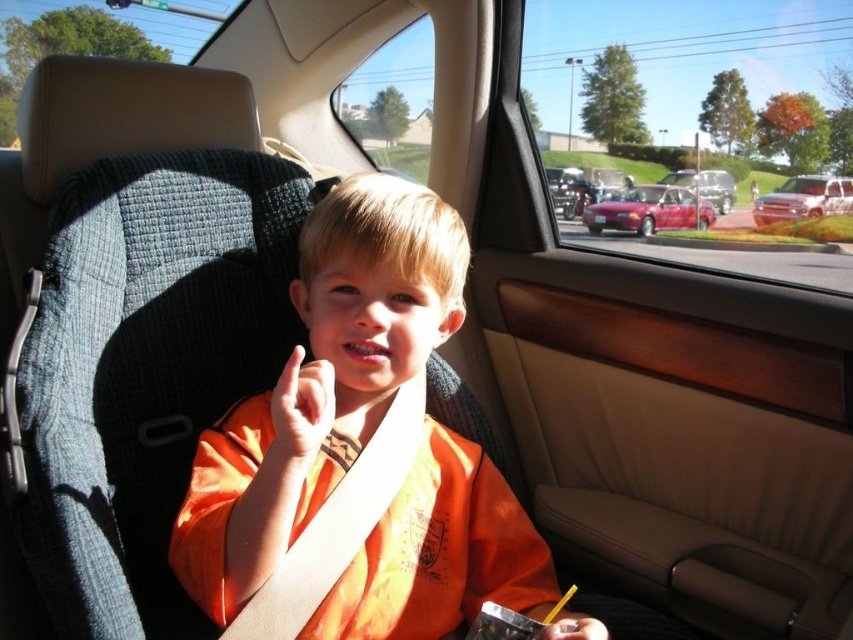
Does white fabric seatbelt at center have a greater height compared to shiny red sedan at center?

Incorrect, white fabric seatbelt at center's height is not larger of shiny red sedan at center's.

At what (x,y) coordinates should I click in order to perform the action: click on white fabric seatbelt at center. Please return your answer as a coordinate pair (x, y). The width and height of the screenshot is (853, 640). Looking at the image, I should click on (337, 524).

This screenshot has width=853, height=640. What are the coordinates of `white fabric seatbelt at center` in the screenshot? It's located at (337, 524).

In the scene shown: Can you confirm if orange fabric shirt at center is taller than shiny red sedan at center?

Yes, orange fabric shirt at center is taller than shiny red sedan at center.

Which is above, orange fabric shirt at center or shiny red sedan at center?

shiny red sedan at center

Is point (490, 520) positioned behind point (631, 220)?

No.

Locate an element on the screen. The width and height of the screenshot is (853, 640). orange fabric shirt at center is located at coordinates (321, 381).

Does orange fabric shirt at center appear under white fabric seatbelt at center?

Incorrect, orange fabric shirt at center is not positioned below white fabric seatbelt at center.

Is orange fabric shirt at center wider than white fabric seatbelt at center?

Yes.

Is point (492, 484) closer to viewer compared to point (372, 515)?

No, (492, 484) is further to viewer.

Where is `orange fabric shirt at center`? The image size is (853, 640). orange fabric shirt at center is located at coordinates (321, 381).